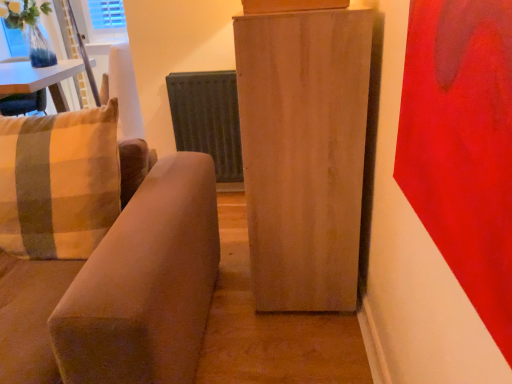
Question: Is metallic gray radiator at center inside the boundaries of light wood cabinet at center, or outside?

Choices:
 (A) inside
 (B) outside

Answer: (B)

Question: From the image's perspective, is metallic gray radiator at center positioned above or below light wood cabinet at center?

Choices:
 (A) below
 (B) above

Answer: (B)

Question: Which is nearer to the light wood cabinet at center?

Choices:
 (A) metallic gray radiator at center
 (B) plaid fabric pillow at left
 (C) suede-like beige couch at left

Answer: (C)

Question: Which is farther from the light wood cabinet at center?

Choices:
 (A) metallic gray radiator at center
 (B) plaid fabric pillow at left
 (C) suede-like beige couch at left

Answer: (A)